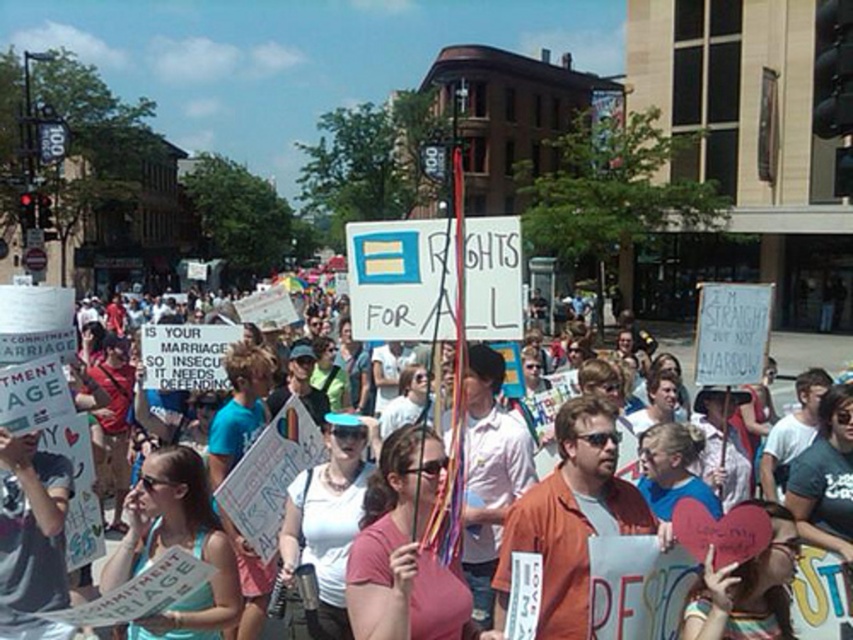
Question: Which of the following is the closest to the observer?

Choices:
 (A) orange cotton shirt at center
 (B) pink matte t-shirt at center
 (C) light blue tank top at center
 (D) white paper sign at center

Answer: (B)

Question: Is orange cotton shirt at center below white paper sign at center?

Choices:
 (A) no
 (B) yes

Answer: (B)

Question: Based on their relative distances, which object is nearer to the pink matte t-shirt at center?

Choices:
 (A) white paper sign at center
 (B) light blue tank top at center

Answer: (B)

Question: From the image, what is the correct spatial relationship of orange cotton shirt at center in relation to white paper sign at center?

Choices:
 (A) left
 (B) right

Answer: (B)

Question: Which object is positioned closest to the orange cotton shirt at center?

Choices:
 (A) white paper sign at center
 (B) pink matte t-shirt at center
 (C) light blue tank top at center

Answer: (B)

Question: Is pink matte t-shirt at center bigger than light blue tank top at center?

Choices:
 (A) yes
 (B) no

Answer: (A)